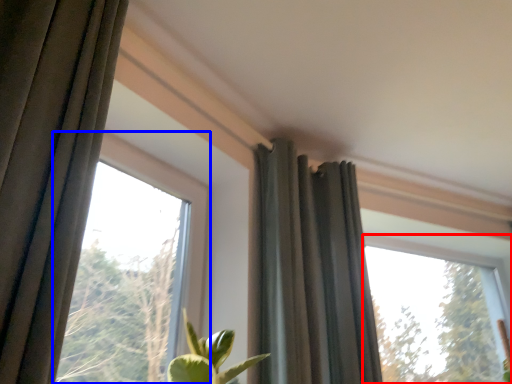
Question: Which of the following is the closest to the observer, window (highlighted by a red box) or window (highlighted by a blue box)?

Choices:
 (A) window
 (B) window

Answer: (B)